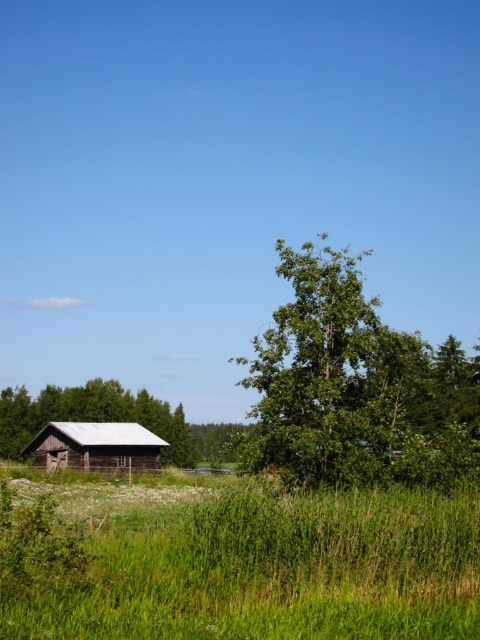
You are standing in the middle of the grassy field looking at two points in the scene. The first point is at coordinates point (x=295, y=598) and the second point is at point (x=118, y=424). Which point is closer to you?

Point (x=295, y=598) is closer to the viewer than point (x=118, y=424).

Please look at the image and tell me what is located at the coordinate point (355, 388). The scene has a rustic wooden barn on the left and a fence running somewhere. The options are a green leafy tree at center or a rusty old tractor at lower right. Which one is it?

The green leafy tree at center is located at point (355, 388).

You are a gardener who wants to plant a new tree in the middle of the green grassy area at lower left. The tree you want to plant requires a minimum of 30 feet of space between it and any other trees. Based on the scene, is there enough space between the green grassy at lower left and the green leafy tree at center to plant the new tree?

The green grassy at lower left and the green leafy tree at center are 37.13 feet apart from each other. Since the required minimum space is 30 feet, there is enough space to plant the new tree.